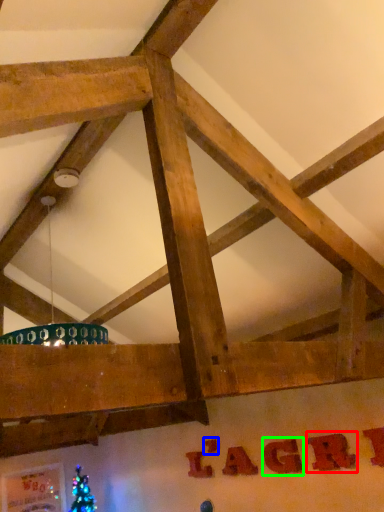
Question: Which is farther away from letter (highlighted by a red box)? letter (highlighted by a blue box) or letter (highlighted by a green box)?

Choices:
 (A) letter
 (B) letter

Answer: (A)